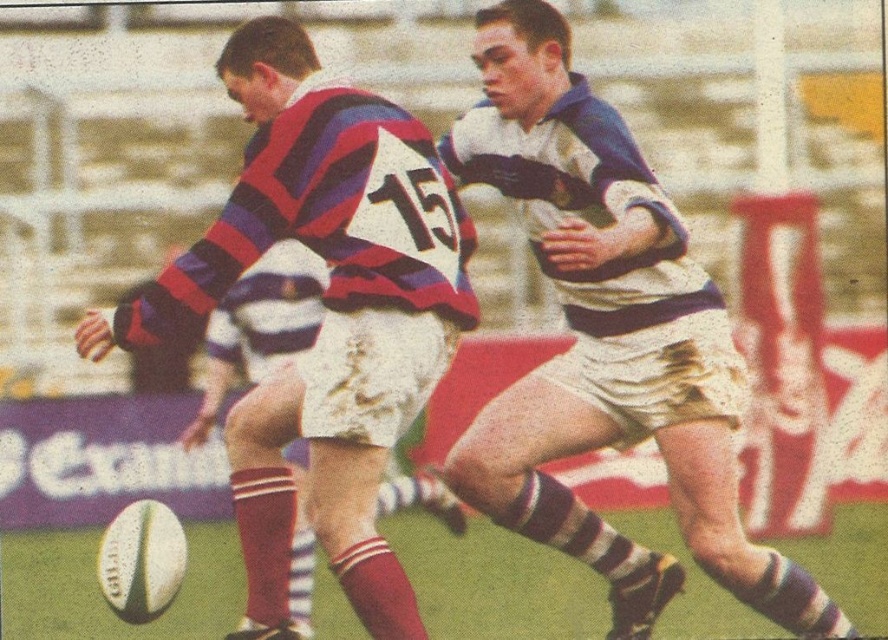
Can you confirm if white textured shorts at center is taller than striped jersey at center?

Indeed, white textured shorts at center has a greater height compared to striped jersey at center.

Does point (561, 74) lie behind point (244, 540)?

Yes, it is behind point (244, 540).

Does point (670, 324) lie in front of point (327, 240)?

No, (670, 324) is behind (327, 240).

You are a GUI agent. You are given a task and a screenshot of the screen. Output one action in this format:
    pyautogui.click(x=<x>, y=<y>)
    Task: Click on the white textured shorts at center
    
    Given the screenshot: What is the action you would take?
    pyautogui.click(x=609, y=340)